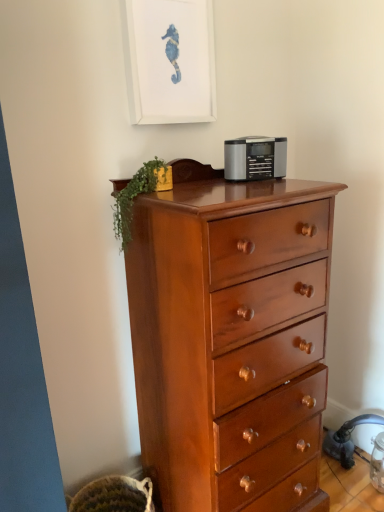
Question: In terms of height, does satin silver radio at center look taller or shorter compared to shiny brown wooden chest of drawers at center?

Choices:
 (A) short
 (B) tall

Answer: (A)

Question: Which is correct: satin silver radio at center is inside shiny brown wooden chest of drawers at center, or outside of it?

Choices:
 (A) outside
 (B) inside

Answer: (B)

Question: Considering the real-world distances, which object is closest to the green leafy plant at upper left?

Choices:
 (A) white matte picture frame at upper center
 (B) satin silver radio at center
 (C) shiny brown wooden chest of drawers at center

Answer: (B)

Question: Which object is the farthest from the green leafy plant at upper left?

Choices:
 (A) white matte picture frame at upper center
 (B) satin silver radio at center
 (C) shiny brown wooden chest of drawers at center

Answer: (C)